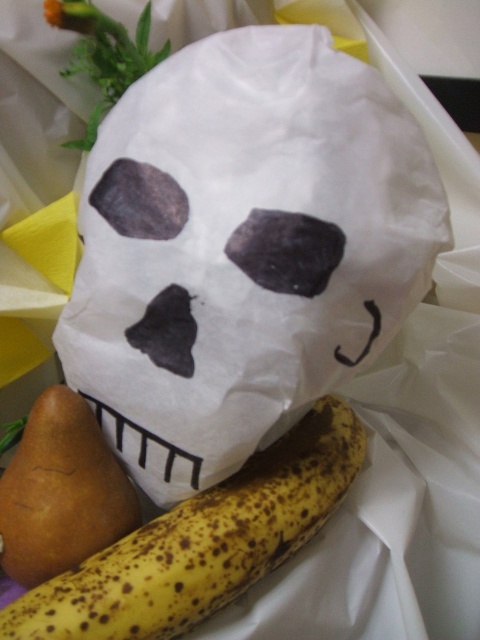
You are organizing a Halloween display and need to place the white paper skull at center and the brown matte pear at lower left. Based on their positions, which object is higher up?

The white paper skull at center is above the brown matte pear at lower left, so it is higher up.

You are organizing a Halloween party and want to place the matte black nose at center on top of the yellow spotted banana at center. Can you do this without moving the banana?

The matte black nose at center is behind the yellow spotted banana at center, so you can place it on top without moving the banana.